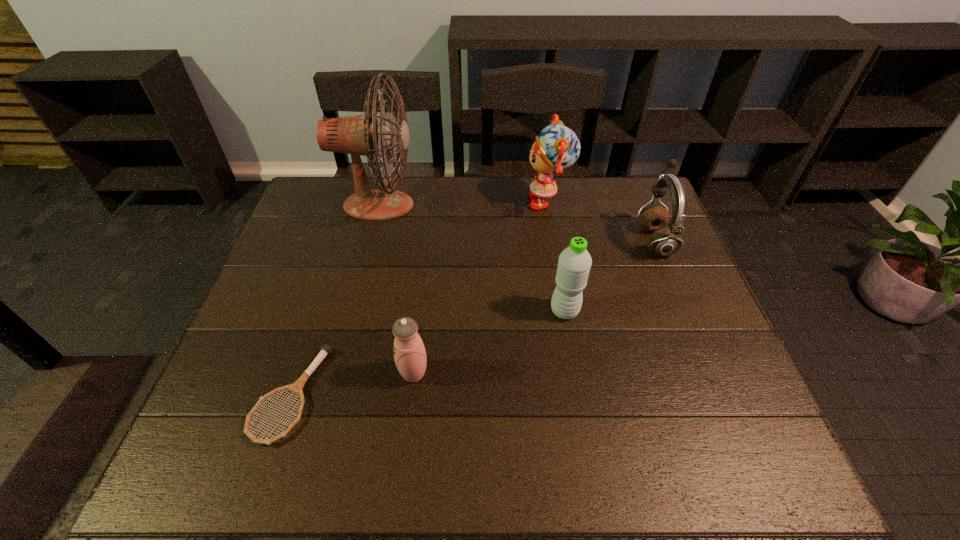
Identify the location of free space between the fan and the earphone. (516, 223).

This screenshot has width=960, height=540. Identify the location of free space between the doll and the fan. [464, 204].

You are a GUI agent. You are given a task and a screenshot of the screen. Output one action in this format:
    pyautogui.click(x=<x>, y=<y>)
    Task: Click on the free point between the tallest object and the doll
    
    Given the screenshot: What is the action you would take?
    pyautogui.click(x=464, y=204)

Find the location of a particular element. The width and height of the screenshot is (960, 540). object that is the second closest one to the doll is located at coordinates (574, 264).

Find the location of a particular element. This screenshot has width=960, height=540. the closest object to the water bottle is located at coordinates (663, 242).

You are a GUI agent. You are given a task and a screenshot of the screen. Output one action in this format:
    pyautogui.click(x=<x>, y=<y>)
    Task: Click on the vacant space that satisfies the following two spatial constraints: 1. on the face of the doll; 2. on the front side of the third nearest object
    The height and width of the screenshot is (540, 960).
    Given the screenshot: What is the action you would take?
    pyautogui.click(x=568, y=311)

This screenshot has height=540, width=960. I want to click on free space that satisfies the following two spatial constraints: 1. on the back side of the third object from left to right; 2. on the left side of the fourth farthest object, so click(421, 311).

Find the location of a particular element. The height and width of the screenshot is (540, 960). free point that satisfies the following two spatial constraints: 1. in front of the tallest object to direct airflow; 2. on the right side of the water bottle is located at coordinates (351, 311).